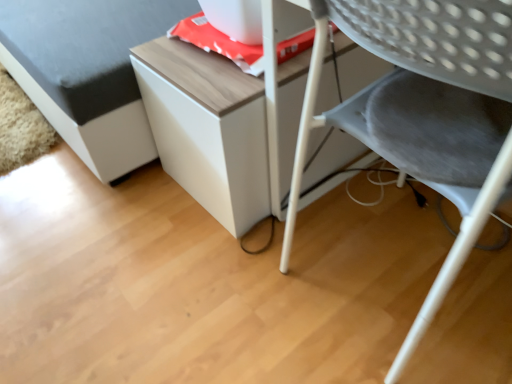
Question: From a real-world perspective, is white matte cabinet at upper center physically located above or below wooden table at center?

Choices:
 (A) above
 (B) below

Answer: (A)

Question: Considering the relative positions of white matte cabinet at upper center and wooden table at center in the image provided, is white matte cabinet at upper center to the left or to the right of wooden table at center?

Choices:
 (A) right
 (B) left

Answer: (B)

Question: Based on their relative distances, which object is nearer to the white matte cabinet at upper center?

Choices:
 (A) wooden table at center
 (B) gray fabric chair at lower right

Answer: (A)

Question: Considering the real-world distances, which object is closest to the white matte cabinet at upper center?

Choices:
 (A) wooden table at center
 (B) gray fabric chair at lower right

Answer: (A)